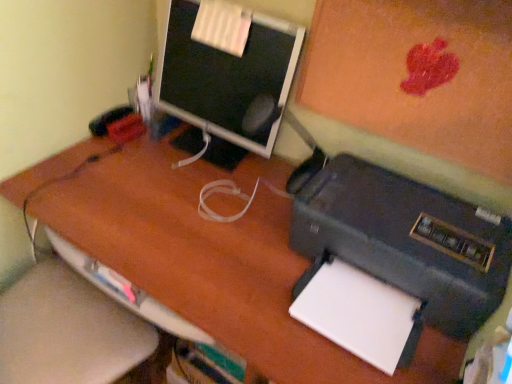
Question: Does matte black monitor at upper center have a lesser height compared to white paper at lower right?

Choices:
 (A) yes
 (B) no

Answer: (B)

Question: Is matte black monitor at upper center positioned beyond the bounds of white paper at lower right?

Choices:
 (A) no
 (B) yes

Answer: (B)

Question: From the image's perspective, is matte black monitor at upper center above white paper at lower right?

Choices:
 (A) no
 (B) yes

Answer: (B)

Question: From a real-world perspective, is matte black monitor at upper center located beneath white paper at lower right?

Choices:
 (A) no
 (B) yes

Answer: (A)

Question: From the image's perspective, is matte black monitor at upper center under white paper at lower right?

Choices:
 (A) yes
 (B) no

Answer: (B)

Question: Is matte black monitor at upper center in front of white paper at lower right?

Choices:
 (A) yes
 (B) no

Answer: (B)

Question: Is white paper at lower right not inside black matte printer at lower right?

Choices:
 (A) yes
 (B) no

Answer: (B)

Question: Does white paper at lower right appear on the left side of black matte printer at lower right?

Choices:
 (A) yes
 (B) no

Answer: (A)

Question: Does white paper at lower right come in front of black matte printer at lower right?

Choices:
 (A) no
 (B) yes

Answer: (A)

Question: Can you confirm if white paper at lower right is thinner than black matte printer at lower right?

Choices:
 (A) no
 (B) yes

Answer: (B)

Question: From the image's perspective, is white paper at lower right on black matte printer at lower right?

Choices:
 (A) no
 (B) yes

Answer: (A)

Question: From a real-world perspective, is white paper at lower right on top of black matte printer at lower right?

Choices:
 (A) no
 (B) yes

Answer: (A)

Question: From the image's perspective, would you say matte black monitor at upper center is positioned over black matte printer at lower right?

Choices:
 (A) yes
 (B) no

Answer: (A)